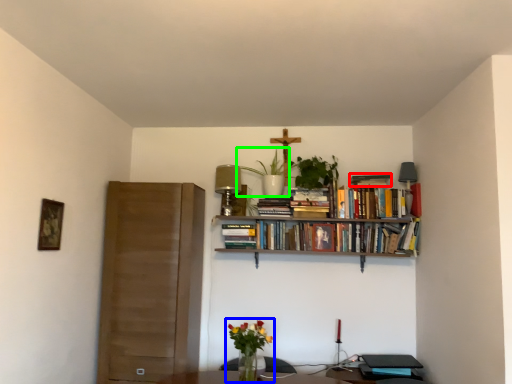
Question: Which object is the closest to the book (highlighted by a red box)? Choose among these: floral arrangement (highlighted by a blue box) or plant (highlighted by a green box).

Choices:
 (A) floral arrangement
 (B) plant

Answer: (B)